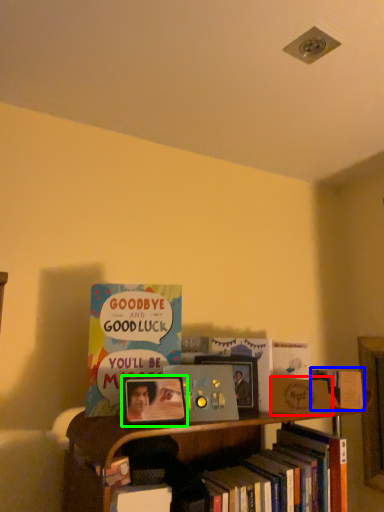
Question: Based on their relative distances, which object is nearer to paperback book (highlighted by a red box)? Choose from book (highlighted by a blue box) and picture frame (highlighted by a green box).

Choices:
 (A) book
 (B) picture frame

Answer: (A)